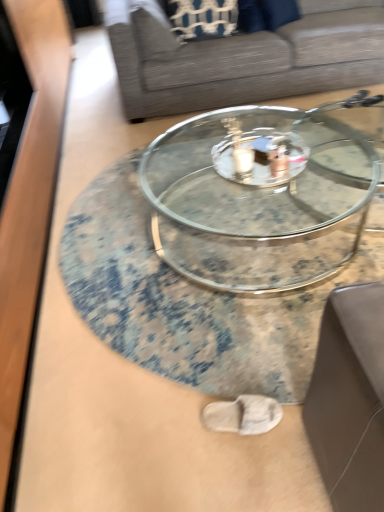
The image size is (384, 512). Describe the element at coordinates (188, 301) in the screenshot. I see `transparent glass coffee table at center, marked as the 2th coffee table in a back-to-front arrangement` at that location.

Where is `clear glass coffee table at center, the 2th coffee table from the front`? clear glass coffee table at center, the 2th coffee table from the front is located at coordinates (255, 202).

From their relative heights in the image, would you say clear glass coffee table at center, the 2th coffee table from the front, is taller or shorter than transparent glass coffee table at center, marked as the 2th coffee table in a back-to-front arrangement?

clear glass coffee table at center, the 2th coffee table from the front, is taller than transparent glass coffee table at center, marked as the 2th coffee table in a back-to-front arrangement.

Are clear glass coffee table at center, the 1th coffee table when ordered from back to front, and transparent glass coffee table at center, the first coffee table viewed from the front, making contact?

No, clear glass coffee table at center, the 1th coffee table when ordered from back to front, is not touching transparent glass coffee table at center, the first coffee table viewed from the front.

Can you confirm if clear glass coffee table at center, the 2th coffee table from the front, is bigger than transparent glass coffee table at center, marked as the 2th coffee table in a back-to-front arrangement?

Yes.

From a real-world perspective, is clear glass coffee table at center, the 2th coffee table from the front, positioned above or below transparent glass coffee table at center, the first coffee table viewed from the front?

In terms of real-world spatial position, clear glass coffee table at center, the 2th coffee table from the front, is above transparent glass coffee table at center, the first coffee table viewed from the front.

From a real-world perspective, is clear glass coffee table at center, the 2th coffee table from the front, physically below gray fabric couch at center?

Yes, from a real-world perspective, clear glass coffee table at center, the 2th coffee table from the front, is below gray fabric couch at center.

Between clear glass coffee table at center, the 1th coffee table when ordered from back to front, and gray fabric couch at center, which one has smaller size?

Smaller between the two is clear glass coffee table at center, the 1th coffee table when ordered from back to front.

Is clear glass coffee table at center, the 2th coffee table from the front, in front of or behind gray fabric couch at center in the image?

Visually, clear glass coffee table at center, the 2th coffee table from the front, is located in front of gray fabric couch at center.

Between clear glass coffee table at center, the 2th coffee table from the front, and gray fabric couch at center, which one appears on the left side from the viewer's perspective?

From the viewer's perspective, clear glass coffee table at center, the 2th coffee table from the front, appears more on the left side.

From the picture: Which is correct: transparent glass coffee table at center, marked as the 2th coffee table in a back-to-front arrangement, is inside clear glass coffee table at center, the 1th coffee table when ordered from back to front, or outside of it?

transparent glass coffee table at center, marked as the 2th coffee table in a back-to-front arrangement, is located beyond the bounds of clear glass coffee table at center, the 1th coffee table when ordered from back to front.

What are the coordinates of `coffee table on the right of transparent glass coffee table at center, the first coffee table viewed from the front` in the screenshot? It's located at (255, 202).

Which of these two, transparent glass coffee table at center, marked as the 2th coffee table in a back-to-front arrangement, or clear glass coffee table at center, the 1th coffee table when ordered from back to front, is wider?

transparent glass coffee table at center, marked as the 2th coffee table in a back-to-front arrangement, is wider.

Based on their positions, is transparent glass coffee table at center, the first coffee table viewed from the front, located to the left or right of clear glass coffee table at center, the 2th coffee table from the front?

transparent glass coffee table at center, the first coffee table viewed from the front, is to the left of clear glass coffee table at center, the 2th coffee table from the front.

Is gray fabric couch at center aimed at clear glass coffee table at center, the 1th coffee table when ordered from back to front?

Yes, gray fabric couch at center faces towards clear glass coffee table at center, the 1th coffee table when ordered from back to front.

From the image's perspective, does gray fabric couch at center appear lower than clear glass coffee table at center, the 2th coffee table from the front?

No.

Which point is more distant from viewer, [282,27] or [312,216]?

The point [282,27] is farther from the camera.

Considering the sizes of objects gray fabric couch at center and transparent glass coffee table at center, marked as the 2th coffee table in a back-to-front arrangement, in the image provided, who is taller, gray fabric couch at center or transparent glass coffee table at center, marked as the 2th coffee table in a back-to-front arrangement,?

Standing taller between the two is gray fabric couch at center.

Does gray fabric couch at center lie behind transparent glass coffee table at center, the first coffee table viewed from the front?

Yes, it is behind transparent glass coffee table at center, the first coffee table viewed from the front.

Based on the photo, can you confirm if gray fabric couch at center is bigger than transparent glass coffee table at center, the first coffee table viewed from the front?

Yes, gray fabric couch at center is bigger than transparent glass coffee table at center, the first coffee table viewed from the front.

Consider the image. Is gray fabric couch at center wider or thinner than transparent glass coffee table at center, marked as the 2th coffee table in a back-to-front arrangement?

gray fabric couch at center is thinner than transparent glass coffee table at center, marked as the 2th coffee table in a back-to-front arrangement.

Which of these two, transparent glass coffee table at center, the first coffee table viewed from the front, or gray fabric couch at center, is wider?

transparent glass coffee table at center, the first coffee table viewed from the front, is wider.

Is transparent glass coffee table at center, marked as the 2th coffee table in a back-to-front arrangement, positioned far away from gray fabric couch at center?

Yes, transparent glass coffee table at center, marked as the 2th coffee table in a back-to-front arrangement, is far from gray fabric couch at center.

Which object is closer to the camera, transparent glass coffee table at center, marked as the 2th coffee table in a back-to-front arrangement, or gray fabric couch at center?

transparent glass coffee table at center, marked as the 2th coffee table in a back-to-front arrangement, is closer to the camera.

I want to click on coffee table that appears in front of the clear glass coffee table at center, the 2th coffee table from the front, so click(x=188, y=301).

From the image's perspective, which coffee table is the 1st one below the gray fabric couch at center? Please provide its 2D coordinates.

[(255, 202)]

Which object lies nearer to the anchor point clear glass coffee table at center, the 1th coffee table when ordered from back to front, gray fabric couch at center or transparent glass coffee table at center, the first coffee table viewed from the front?

transparent glass coffee table at center, the first coffee table viewed from the front, lies closer to clear glass coffee table at center, the 1th coffee table when ordered from back to front, than the other object.

Which object lies nearer to the anchor point transparent glass coffee table at center, marked as the 2th coffee table in a back-to-front arrangement, gray fabric couch at center or clear glass coffee table at center, the 2th coffee table from the front?

The object closer to transparent glass coffee table at center, marked as the 2th coffee table in a back-to-front arrangement, is clear glass coffee table at center, the 2th coffee table from the front.

Considering their positions, is transparent glass coffee table at center, the first coffee table viewed from the front, positioned further to clear glass coffee table at center, the 2th coffee table from the front, than gray fabric couch at center?

The object further to clear glass coffee table at center, the 2th coffee table from the front, is gray fabric couch at center.

Based on their spatial positions, is clear glass coffee table at center, the 1th coffee table when ordered from back to front, or transparent glass coffee table at center, marked as the 2th coffee table in a back-to-front arrangement, further from gray fabric couch at center?

The object further to gray fabric couch at center is transparent glass coffee table at center, marked as the 2th coffee table in a back-to-front arrangement.

Which object lies further to the anchor point transparent glass coffee table at center, marked as the 2th coffee table in a back-to-front arrangement, clear glass coffee table at center, the 2th coffee table from the front, or gray fabric couch at center?

The object further to transparent glass coffee table at center, marked as the 2th coffee table in a back-to-front arrangement, is gray fabric couch at center.

When comparing their distances from gray fabric couch at center, does transparent glass coffee table at center, marked as the 2th coffee table in a back-to-front arrangement, or clear glass coffee table at center, the 2th coffee table from the front, seem closer?

clear glass coffee table at center, the 2th coffee table from the front.

At what (x,y) coordinates should I click in order to perform the action: click on coffee table that lies between gray fabric couch at center and transparent glass coffee table at center, marked as the 2th coffee table in a back-to-front arrangement, from top to bottom. Please return your answer as a coordinate pair (x, y). Image resolution: width=384 pixels, height=512 pixels. Looking at the image, I should click on (x=255, y=202).